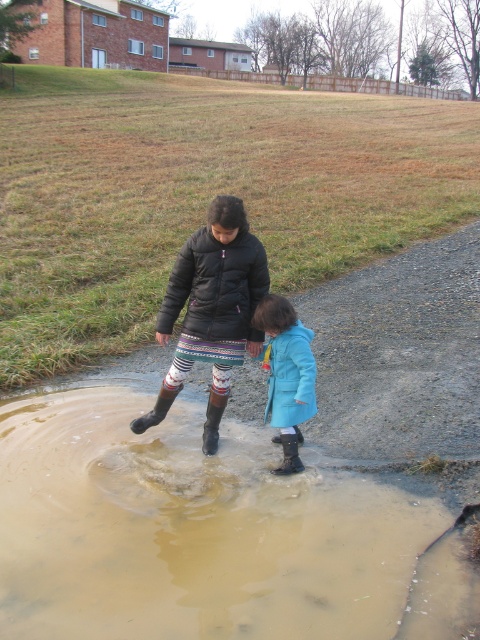
Question: Does black puffy jacket at center have a lesser width compared to black rubber rain boot at lower center?

Choices:
 (A) no
 (B) yes

Answer: (A)

Question: Among these objects, which one is farthest from the camera?

Choices:
 (A) black fuzzy jacket at center
 (B) black rubber rain boot at lower center

Answer: (B)

Question: Estimate the real-world distances between objects in this image. Which object is closer to the black fuzzy jacket at center?

Choices:
 (A) brown muddy water at lower center
 (B) black rubber rain boot at lower center

Answer: (B)

Question: Observing the image, what is the correct spatial positioning of matte black boot at lower left in reference to black rubber rain boot at lower center?

Choices:
 (A) left
 (B) right

Answer: (A)

Question: Where is black fuzzy jacket at center located in relation to black puffy jacket at center in the image?

Choices:
 (A) below
 (B) above

Answer: (A)

Question: Among these points, which one is nearest to the camera?

Choices:
 (A) (195, 244)
 (B) (216, 404)

Answer: (A)